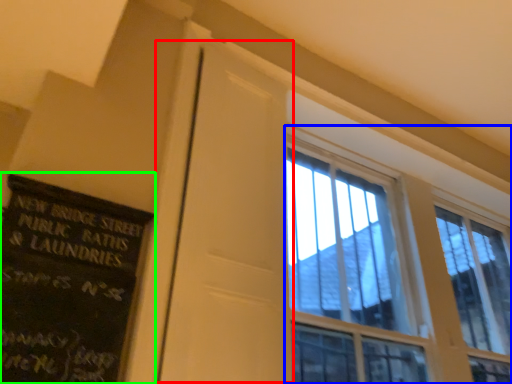
Question: Which object is positioned closest to screen door (highlighted by a red box)? Select from window (highlighted by a blue box) and bulletin board (highlighted by a green box).

Choices:
 (A) window
 (B) bulletin board

Answer: (B)